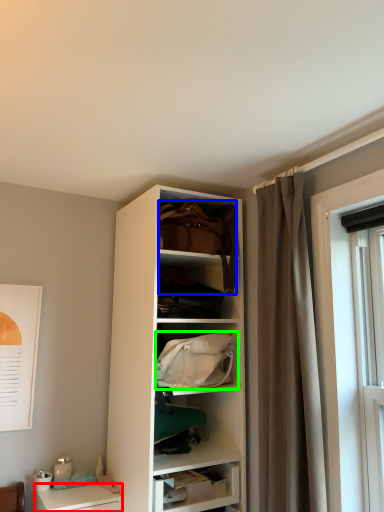
Question: Which object is positioned farthest from desk (highlighted by a red box)? Select from handbag (highlighted by a blue box) and handbag (highlighted by a green box).

Choices:
 (A) handbag
 (B) handbag

Answer: (A)